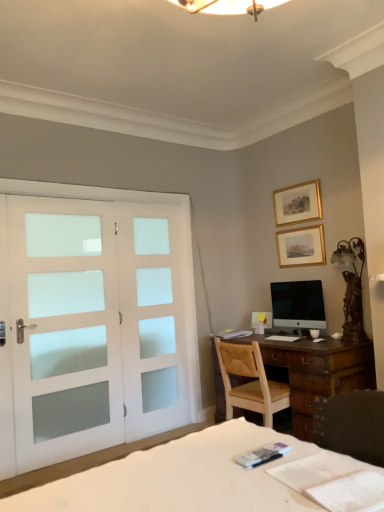
Question: Does black glossy monitor at center touch light brown wooden chair at center?

Choices:
 (A) no
 (B) yes

Answer: (A)

Question: Is light brown wooden chair at center inside black glossy monitor at center?

Choices:
 (A) yes
 (B) no

Answer: (B)

Question: From a real-world perspective, is black glossy monitor at center below light brown wooden chair at center?

Choices:
 (A) yes
 (B) no

Answer: (B)

Question: Does black glossy monitor at center have a larger size compared to light brown wooden chair at center?

Choices:
 (A) yes
 (B) no

Answer: (B)

Question: From the image's perspective, does black glossy monitor at center appear higher than light brown wooden chair at center?

Choices:
 (A) no
 (B) yes

Answer: (B)

Question: Is black glossy monitor at center wider than light brown wooden chair at center?

Choices:
 (A) yes
 (B) no

Answer: (B)

Question: Considering the relative sizes of black glossy monitor at center and bronze/metallic table lamp at right in the image provided, is black glossy monitor at center shorter than bronze/metallic table lamp at right?

Choices:
 (A) no
 (B) yes

Answer: (B)

Question: Considering the relative positions of black glossy monitor at center and bronze/metallic table lamp at right in the image provided, is black glossy monitor at center in front of bronze/metallic table lamp at right?

Choices:
 (A) no
 (B) yes

Answer: (A)

Question: From the image's perspective, is black glossy monitor at center on top of bronze/metallic table lamp at right?

Choices:
 (A) yes
 (B) no

Answer: (B)

Question: Is black glossy monitor at center looking in the opposite direction of bronze/metallic table lamp at right?

Choices:
 (A) yes
 (B) no

Answer: (B)

Question: Is black glossy monitor at center bigger than bronze/metallic table lamp at right?

Choices:
 (A) no
 (B) yes

Answer: (A)

Question: Is black glossy monitor at center next to bronze/metallic table lamp at right?

Choices:
 (A) no
 (B) yes

Answer: (A)

Question: Considering the relative sizes of gold-framed picture at upper right, which appears as the 2th picture frame when viewed from the top, and gold/gilded picture frame at upper center, positioned as the 1th picture frame in top-to-bottom order, in the image provided, is gold-framed picture at upper right, which appears as the 2th picture frame when viewed from the top, taller than gold/gilded picture frame at upper center, positioned as the 1th picture frame in top-to-bottom order,?

Choices:
 (A) yes
 (B) no

Answer: (A)